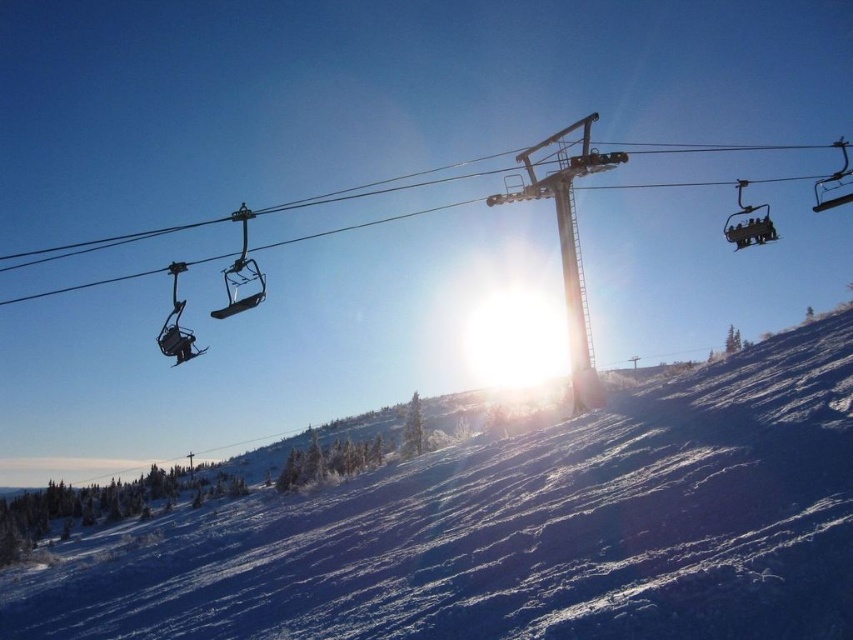
Question: Which point is closer to the camera taking this photo?

Choices:
 (A) (245, 259)
 (B) (752, 209)

Answer: (A)

Question: Does white powdery snow at center come behind metallic gray ski lift at upper right?

Choices:
 (A) yes
 (B) no

Answer: (B)

Question: Among these points, which one is nearest to the camera?

Choices:
 (A) (759, 234)
 (B) (242, 230)

Answer: (A)

Question: Does white powdery snow at center have a smaller size compared to metallic black ski lift at center-left?

Choices:
 (A) yes
 (B) no

Answer: (B)

Question: Can you confirm if white powdery snow at center is smaller than metallic gray ski lift at upper right?

Choices:
 (A) no
 (B) yes

Answer: (A)

Question: Which point is closer to the camera?

Choices:
 (A) white powdery snow at center
 (B) metallic gray ski lift at upper right

Answer: (A)